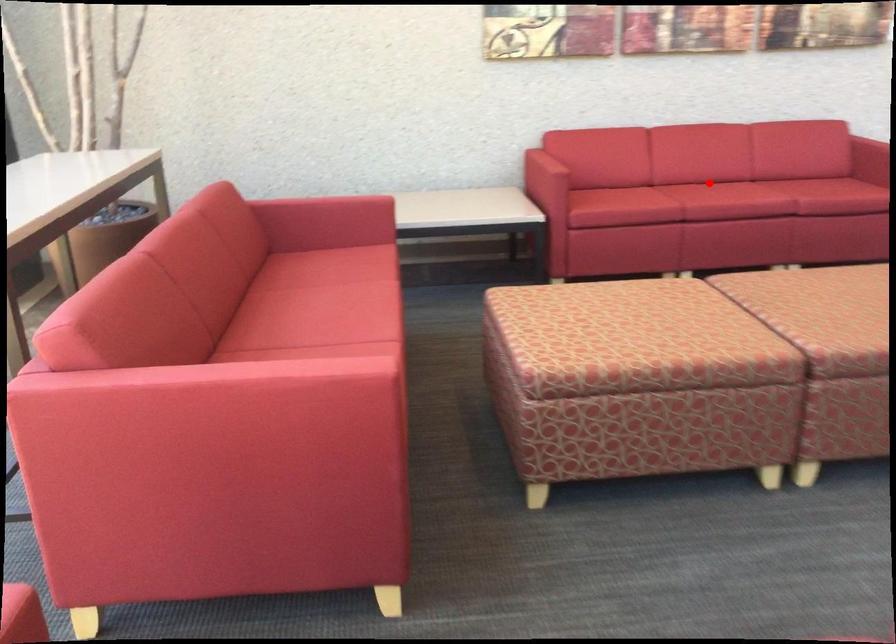
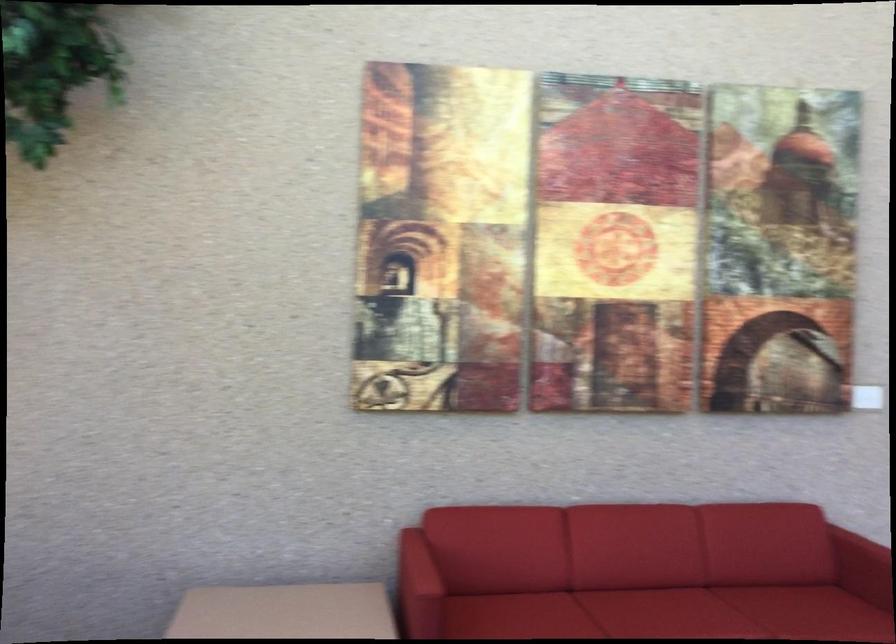
Question: I am providing you with two images of the same scene from different viewpoints. A red point is shown in image1. For the corresponding object point in image2, is it positioned nearer or farther from the camera?

Choices:
 (A) Nearer
 (B) Farther

Answer: (A)